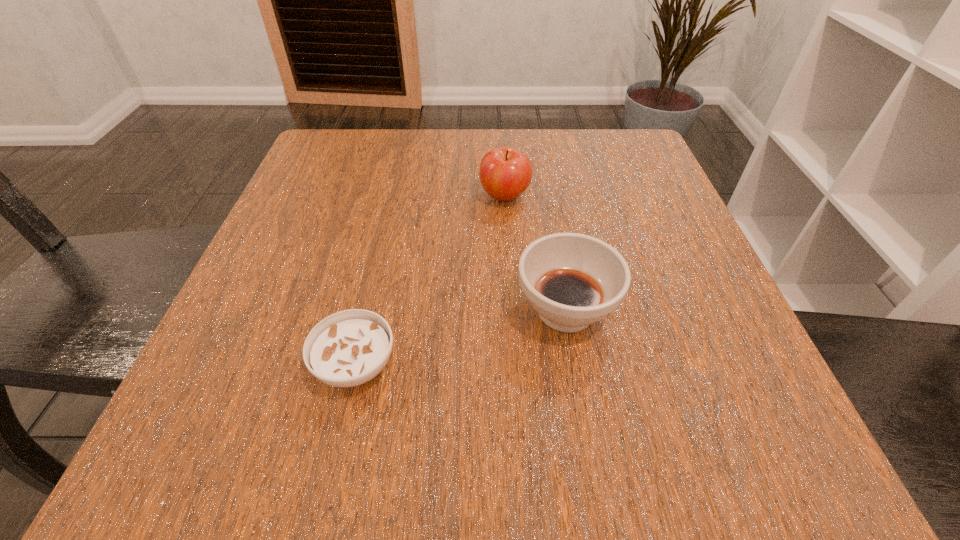
I want to click on vacant space at the near edge, so click(490, 444).

This screenshot has height=540, width=960. In the image, there is a desktop. Find the location of `blank space at the left edge`. blank space at the left edge is located at coordinates (276, 217).

The image size is (960, 540). I want to click on vacant area at the right edge, so click(609, 208).

The image size is (960, 540). What are the coordinates of `free space at the far left corner of the desktop` in the screenshot? It's located at (306, 166).

Image resolution: width=960 pixels, height=540 pixels. In order to click on vacant point at the near left corner in this screenshot , I will do `click(148, 474)`.

Locate an element on the screen. This screenshot has height=540, width=960. free region at the far right corner of the desktop is located at coordinates (574, 143).

Locate an element on the screen. The width and height of the screenshot is (960, 540). free point between the apple and the left soup bowl is located at coordinates (430, 281).

Where is `free spot between the taller soup bowl and the leftmost object`? The width and height of the screenshot is (960, 540). free spot between the taller soup bowl and the leftmost object is located at coordinates point(461,338).

Identify the location of blank region between the left soup bowl and the apple. The image size is (960, 540). (430, 281).

This screenshot has height=540, width=960. Find the location of `free area in between the left soup bowl and the taller soup bowl`. free area in between the left soup bowl and the taller soup bowl is located at coordinates (461, 338).